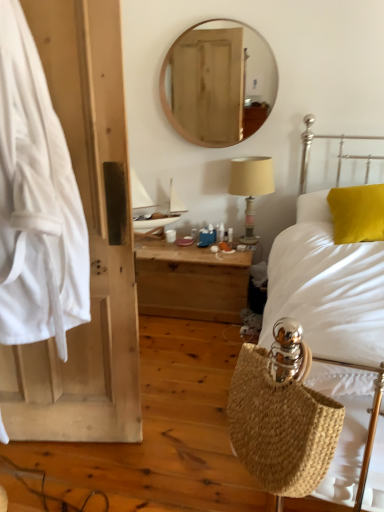
Question: From a real-world perspective, is wooden nightstand at center located beneath yellow fabric pillow at right?

Choices:
 (A) no
 (B) yes

Answer: (B)

Question: From a real-world perspective, is wooden nightstand at center on top of yellow fabric pillow at right?

Choices:
 (A) yes
 (B) no

Answer: (B)

Question: Does wooden nightstand at center appear on the left side of yellow fabric pillow at right?

Choices:
 (A) yes
 (B) no

Answer: (A)

Question: Is yellow fabric pillow at right a part of wooden nightstand at center?

Choices:
 (A) yes
 (B) no

Answer: (B)

Question: Does wooden nightstand at center have a lesser width compared to yellow fabric pillow at right?

Choices:
 (A) no
 (B) yes

Answer: (A)

Question: Is wooden nightstand at center looking in the opposite direction of yellow fabric pillow at right?

Choices:
 (A) no
 (B) yes

Answer: (A)

Question: Is white fabric at left to the right of white woven bag at right from the viewer's perspective?

Choices:
 (A) yes
 (B) no

Answer: (B)

Question: Can you confirm if white fabric at left is taller than white woven bag at right?

Choices:
 (A) yes
 (B) no

Answer: (A)

Question: Is white fabric at left with white woven bag at right?

Choices:
 (A) yes
 (B) no

Answer: (B)

Question: Is white fabric at left oriented away from white woven bag at right?

Choices:
 (A) no
 (B) yes

Answer: (A)

Question: Can you confirm if white fabric at left is bigger than white woven bag at right?

Choices:
 (A) yes
 (B) no

Answer: (B)

Question: Is white fabric at left not within white woven bag at right?

Choices:
 (A) no
 (B) yes

Answer: (B)

Question: Is white fabric at left shorter than wooden nightstand at center?

Choices:
 (A) yes
 (B) no

Answer: (B)